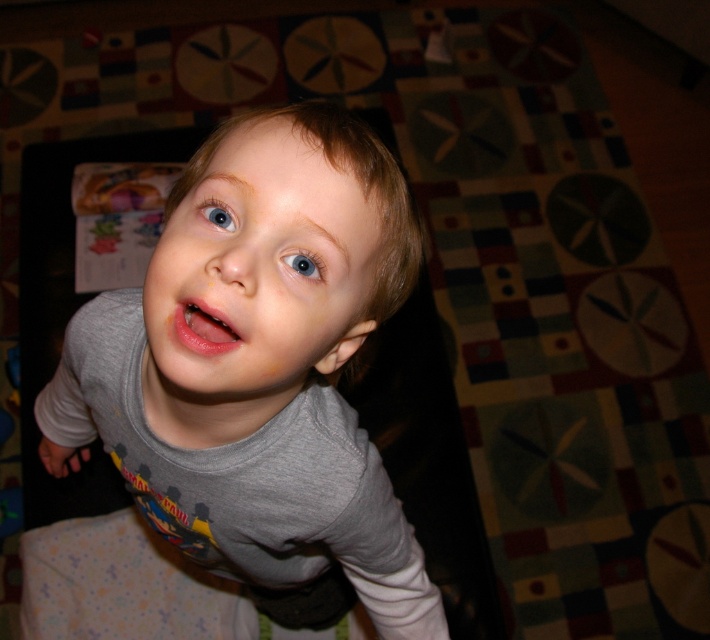
Is gray matte shirt at center taller than smooth gray shirt at center?

Indeed, gray matte shirt at center has a greater height compared to smooth gray shirt at center.

Can you confirm if gray matte shirt at center is smaller than smooth gray shirt at center?

Incorrect, gray matte shirt at center is not smaller in size than smooth gray shirt at center.

Who is more distant from viewer, (187, 532) or (346, 184)?

The point (187, 532) is more distant.

Image resolution: width=710 pixels, height=640 pixels. I want to click on gray matte shirt at center, so click(x=258, y=365).

This screenshot has width=710, height=640. What do you see at coordinates (258, 275) in the screenshot? I see `smooth gray shirt at center` at bounding box center [258, 275].

Between point (337, 330) and point (320, 268), which one is positioned behind?

Positioned behind is point (337, 330).

Locate an element on the screen. This screenshot has height=640, width=710. smooth gray shirt at center is located at coordinates (258, 275).

Who is higher up, smooth gray shirt at center or blue glossy eye at upper center?

blue glossy eye at upper center is above.

Which is behind, point (293, 218) or point (226, 216)?

The point (226, 216) is behind.

Between point (339, 170) and point (214, 205), which one is positioned in front?

Point (339, 170)

This screenshot has height=640, width=710. In order to click on smooth gray shirt at center in this screenshot , I will do `click(258, 275)`.